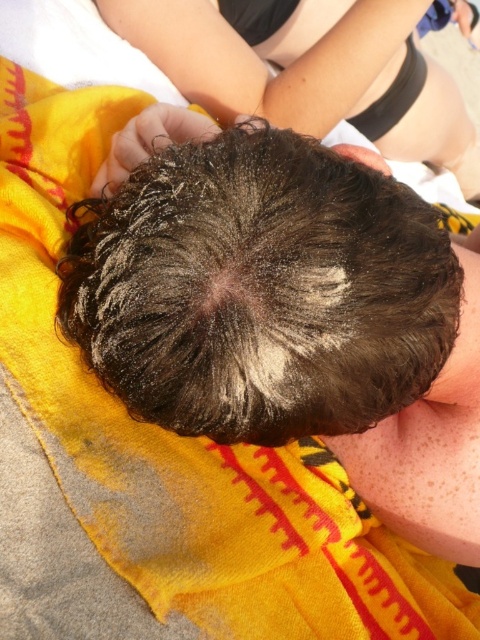
Is point (143, 368) more distant than point (408, 500)?

That is False.

Is dark brown curly hair at center above dry skin at center?

Indeed, dark brown curly hair at center is positioned over dry skin at center.

Who is more distant from viewer, (288, 147) or (402, 448)?

Point (402, 448)

Find the location of a particular element. dark brown curly hair at center is located at coordinates (261, 289).

Can you confirm if dark brown curly hair at center is positioned above dark brown hair at center?

No.

Is dark brown curly hair at center closer to camera compared to dark brown hair at center?

Yes, it is.

Where is `dark brown curly hair at center`? The height and width of the screenshot is (640, 480). dark brown curly hair at center is located at coordinates (261, 289).

Is the position of dark brown hair at center more distant than that of dry skin at center?

Yes, it is behind dry skin at center.

Is dark brown hair at center wider than dry skin at center?

Yes.

This screenshot has height=640, width=480. Describe the element at coordinates (308, 72) in the screenshot. I see `dark brown hair at center` at that location.

The height and width of the screenshot is (640, 480). I want to click on dark brown hair at center, so click(x=308, y=72).